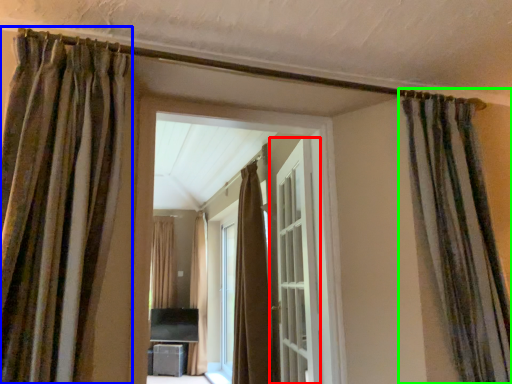
Question: Which is nearer to the door (highlighted by a red box)? curtain (highlighted by a blue box) or curtain (highlighted by a green box).

Choices:
 (A) curtain
 (B) curtain

Answer: (B)